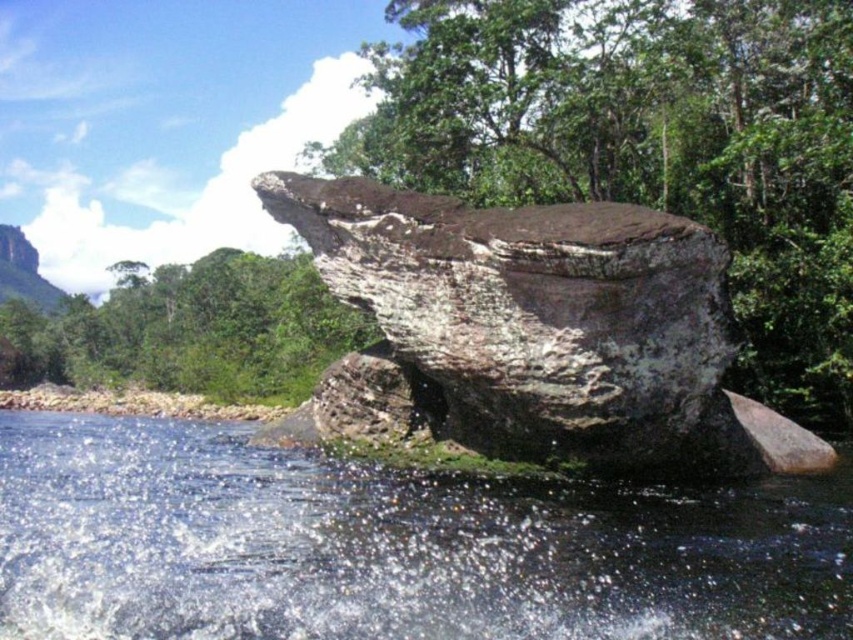
Is point (606, 637) in front of point (721, 275)?

Yes.

Between clear water at center and brown rough rock at center, which one appears on the right side from the viewer's perspective?

brown rough rock at center

Which is behind, point (672, 525) or point (479, 442)?

Point (479, 442)

This screenshot has width=853, height=640. Find the location of `clear water at center`. clear water at center is located at coordinates (390, 547).